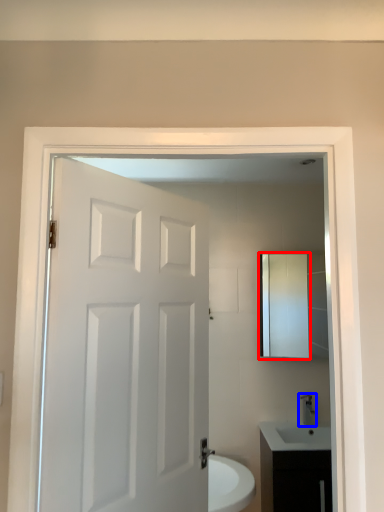
Question: Which of the following is the closest to the observer, medicine cabinet (highlighted by a red box) or tap (highlighted by a blue box)?

Choices:
 (A) medicine cabinet
 (B) tap

Answer: (B)